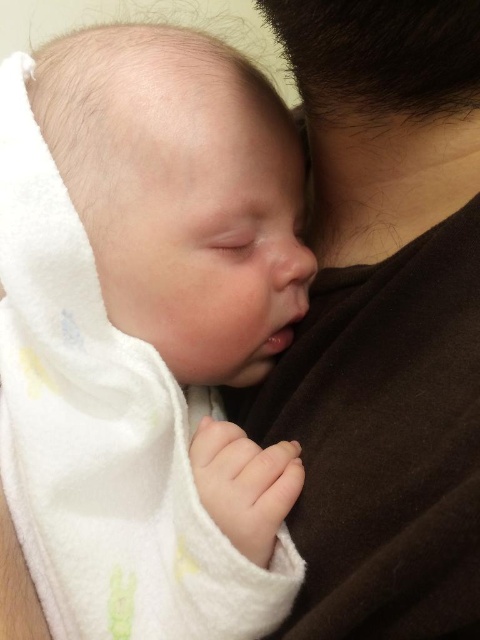
Looking at this image, you are a nurse in a hospital nursery and need to choose between the white soft towel at center and the brown soft fabric at upper right to wrap a newborn. Which item would you select if you want to ensure there is enough material to fully wrap the baby?

→ The brown soft fabric at upper right should be chosen because it occupies more space than the white soft towel at center, providing sufficient material to fully wrap the newborn.

You are a photographer trying to capture a closeup of the white soft towel at center and the brown soft fabric at upper right. Which object should you focus on first to ensure it appears sharp in the photo?

You should focus on the white soft towel at center first because it is closer to the viewer than the brown soft fabric at upper right, so it requires proper focus to appear sharp.

You are a caregiver trying to choose between placing the baby on the white soft towel at center or the brown soft fabric at upper right. Which surface is higher up?

The white soft towel at center is located above the brown soft fabric at upper right, so it is higher up.